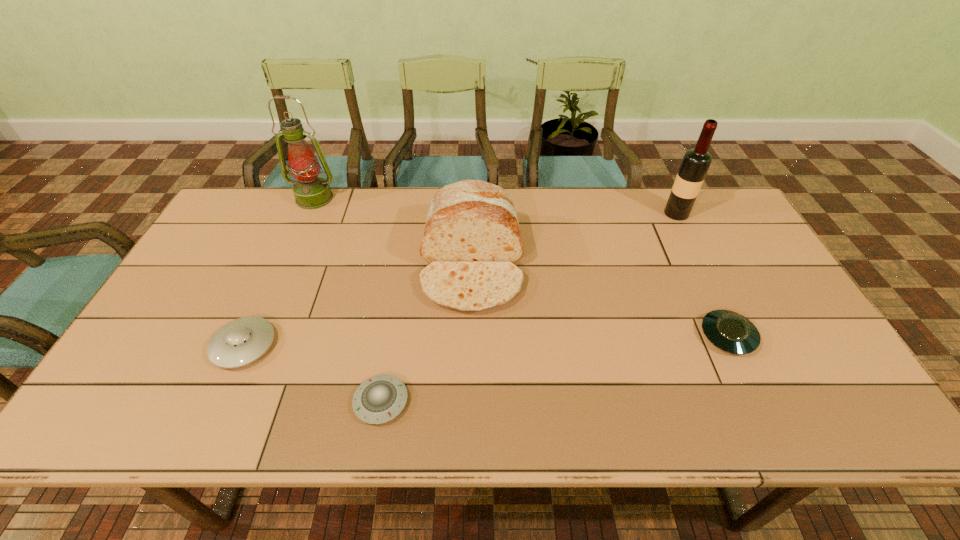
Find the location of a particular element. free space between the rightmost saucer and the third tallest object is located at coordinates (600, 300).

Identify the location of unoccupied position between the rightmost saucer and the wine bottle. (702, 274).

What are the coordinates of `free point between the shortest object and the leftmost saucer` in the screenshot? It's located at (312, 373).

Identify the location of free space between the rightmost saucer and the wine bottle. (702, 274).

Point out which object is positioned as the third nearest to the wine bottle. Please provide its 2D coordinates. Your answer should be formatted as a tuple, i.e. [(x, y)], where the tuple contains the x and y coordinates of a point satisfying the conditions above.

[(379, 399)]

In order to click on object that is the second closest to the oil lamp in this screenshot , I will do `click(242, 341)`.

Point out which saucer is positioned as the second nearest to the oil lamp. Please provide its 2D coordinates. Your answer should be formatted as a tuple, i.e. [(x, y)], where the tuple contains the x and y coordinates of a point satisfying the conditions above.

[(379, 399)]

Locate an element on the screen. The image size is (960, 540). saucer object that ranks as the third closest to the oil lamp is located at coordinates (731, 332).

I want to click on free space in the image that satisfies the following two spatial constraints: 1. at the sliced end of the fourth shortest object; 2. on the left side of the rightmost saucer, so click(x=470, y=336).

Find the location of `free space in the image that satisfies the following two spatial constraints: 1. on the back side of the oil lamp; 2. on the left side of the leftmost saucer`. free space in the image that satisfies the following two spatial constraints: 1. on the back side of the oil lamp; 2. on the left side of the leftmost saucer is located at coordinates (310, 198).